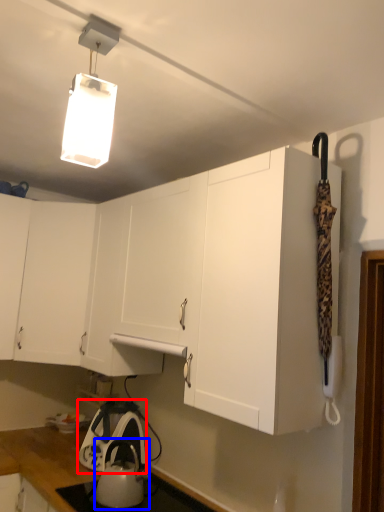
Question: Which point is closer to the camera, appliance (highlighted by a red box) or kettle (highlighted by a blue box)?

Choices:
 (A) appliance
 (B) kettle

Answer: (B)